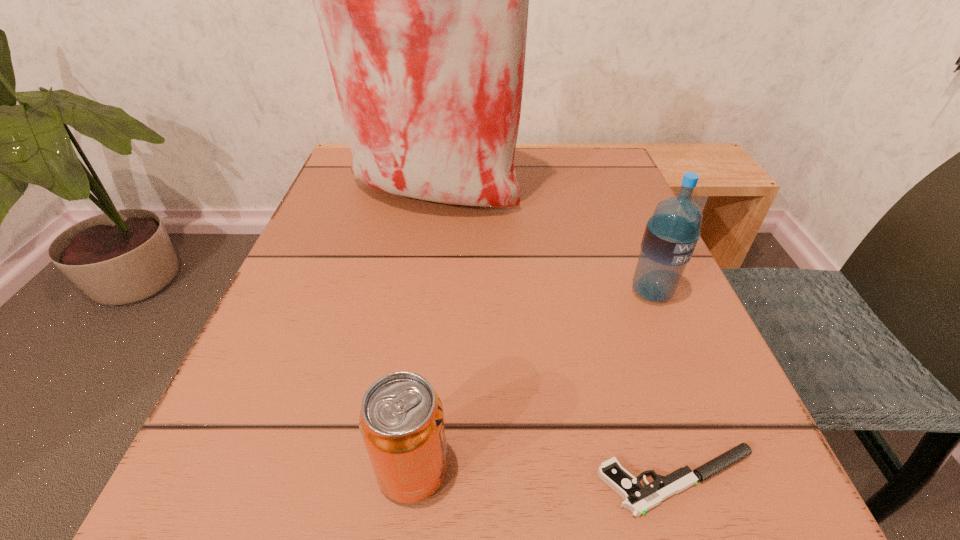
In the image, there is a desktop. At what (x,y) coordinates should I click in order to perform the action: click on vacant space at the near edge. Please return your answer as a coordinate pair (x, y). Image resolution: width=960 pixels, height=540 pixels. Looking at the image, I should click on (456, 525).

At what (x,y) coordinates should I click in order to perform the action: click on free space at the left edge. Please return your answer as a coordinate pair (x, y). The width and height of the screenshot is (960, 540). Looking at the image, I should click on click(x=367, y=210).

Identify the location of vacant space at the right edge of the desktop. (626, 322).

In order to click on free space at the near left corner of the desktop in this screenshot , I will do `click(286, 515)`.

Find the location of `vacant space at the far right corner of the desktop`. vacant space at the far right corner of the desktop is located at coordinates (590, 159).

Locate an element on the screen. This screenshot has height=540, width=960. free space at the near right corner of the desktop is located at coordinates (791, 522).

At what (x,y) coordinates should I click in order to perform the action: click on free area in between the second farthest object and the pistol. Please return your answer as a coordinate pair (x, y). Looking at the image, I should click on (665, 387).

Locate an element on the screen. vacant space that's between the tallest object and the shortest object is located at coordinates (555, 338).

In order to click on vacant space that's between the second shortest object and the tallest object in this screenshot , I will do `click(421, 333)`.

Find the location of a particular element. free spot between the shortest object and the soda can is located at coordinates (546, 475).